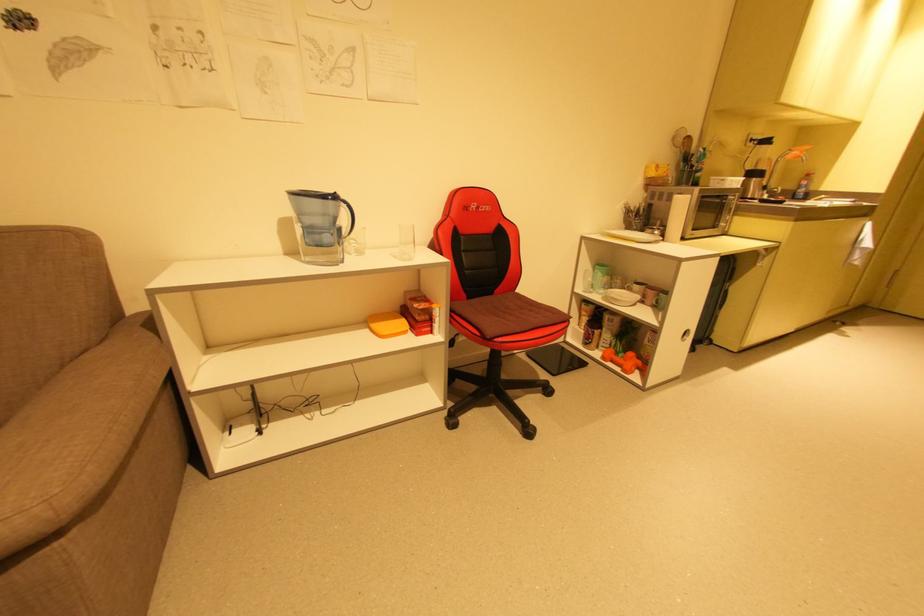
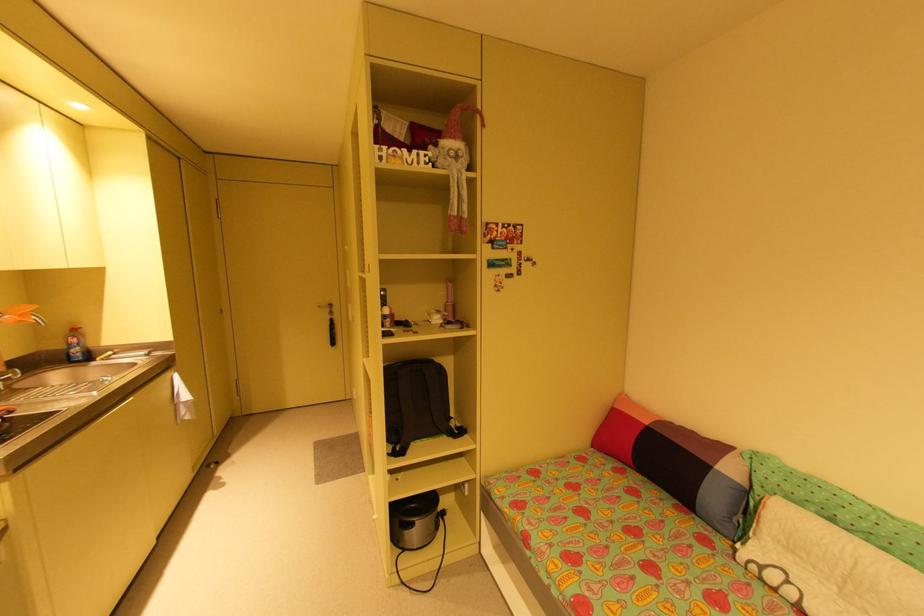
In the second image, find the point that corresponds to (x=812, y=176) in the first image.

(79, 331)